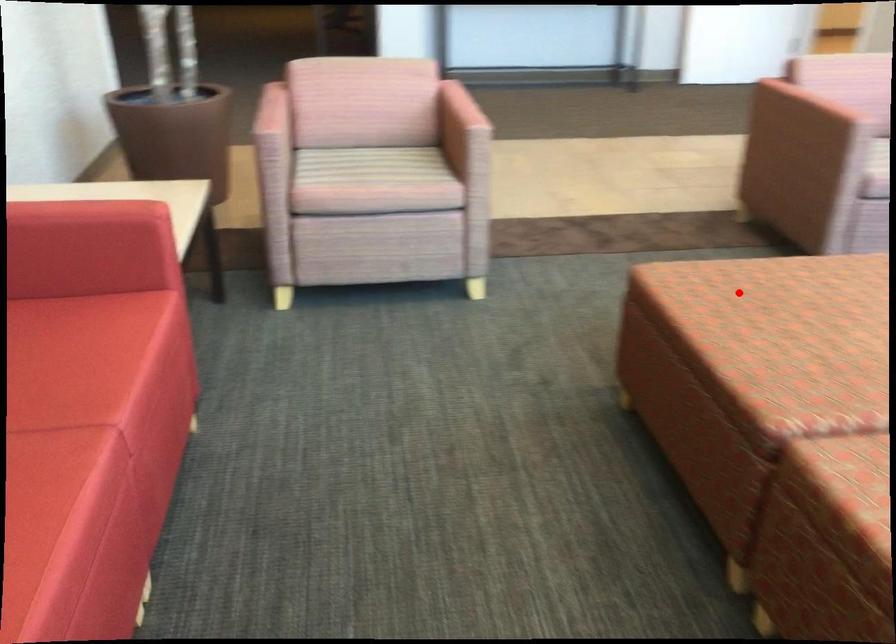
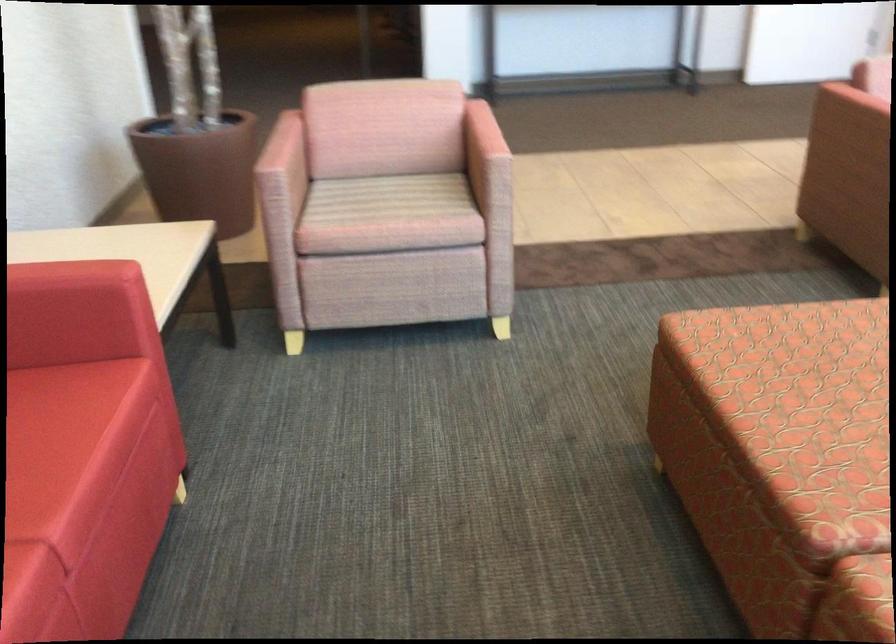
In the second image, find the point that corresponds to the highlighted location in the first image.

(782, 350)